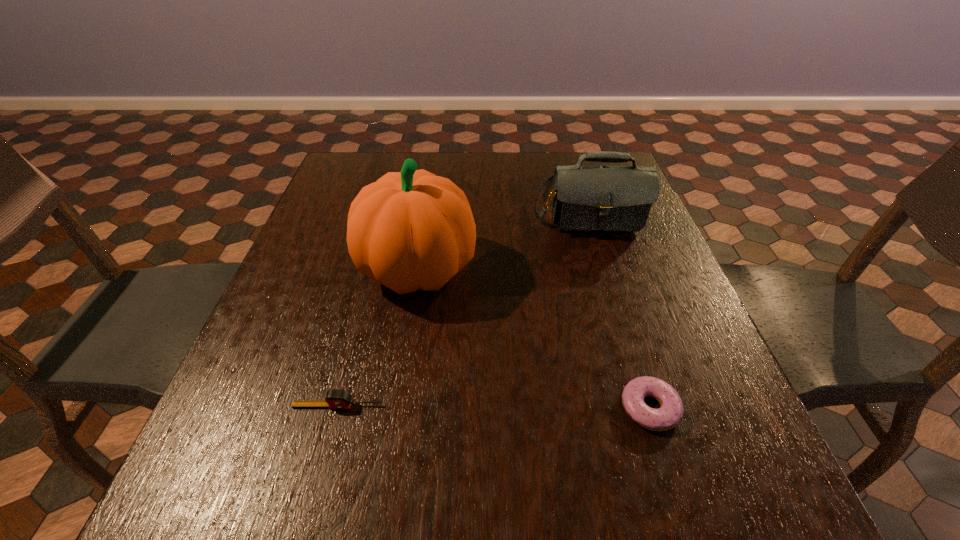
At what (x,y) coordinates should I click in order to perform the action: click on tape measure at the left edge. Please return your answer as a coordinate pair (x, y). The width and height of the screenshot is (960, 540). Looking at the image, I should click on (334, 399).

This screenshot has width=960, height=540. In order to click on shoulder bag at the right edge in this screenshot , I will do `click(584, 198)`.

This screenshot has width=960, height=540. I want to click on doughnut that is at the right edge, so click(670, 413).

Find the location of a particular element. object that is at the far right corner is located at coordinates (584, 198).

This screenshot has width=960, height=540. In the image, there is a desktop. What are the coordinates of `vacant space at the far edge` in the screenshot? It's located at pyautogui.click(x=551, y=154).

Locate an element on the screen. vacant region at the near edge of the desktop is located at coordinates (591, 510).

This screenshot has height=540, width=960. Identify the location of free space at the left edge. (308, 329).

Locate an element on the screen. Image resolution: width=960 pixels, height=540 pixels. vacant space at the right edge of the desktop is located at coordinates (656, 333).

What are the coordinates of `free location at the far left corner` in the screenshot? It's located at (363, 177).

Where is `vacant point located between the doughnut and the second shortest object`? vacant point located between the doughnut and the second shortest object is located at coordinates (493, 407).